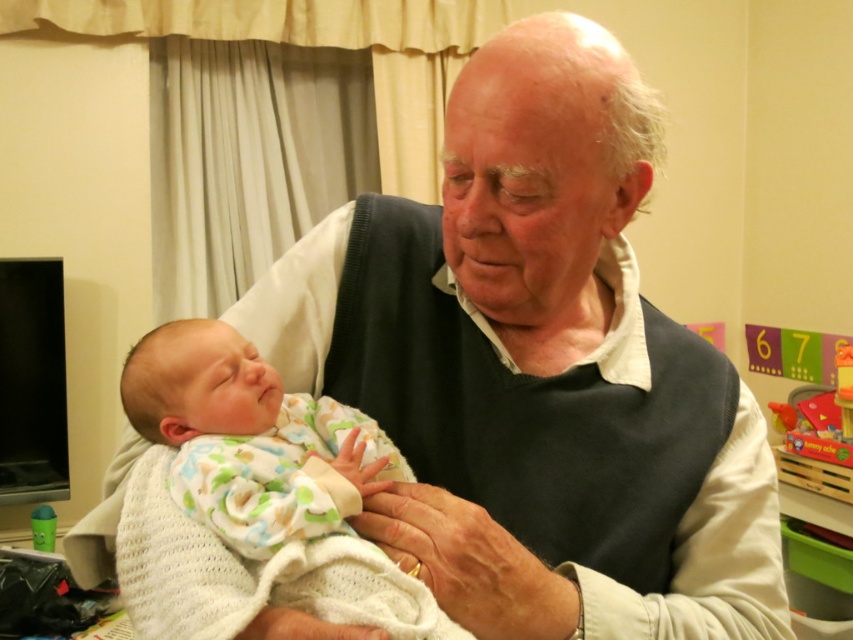
Question: Is white knit swaddle at center positioned behind dark gray sweater at center?

Choices:
 (A) no
 (B) yes

Answer: (A)

Question: Considering the relative positions of white knit swaddle at center and dark gray sweater at center in the image provided, where is white knit swaddle at center located with respect to dark gray sweater at center?

Choices:
 (A) below
 (B) above

Answer: (B)

Question: Which point appears closest to the camera in this image?

Choices:
 (A) (289, 472)
 (B) (428, 531)

Answer: (B)

Question: Does white knit swaddle at center have a smaller size compared to dark gray sweater at center?

Choices:
 (A) no
 (B) yes

Answer: (A)

Question: Among these points, which one is farthest from the camera?

Choices:
 (A) (491, 627)
 (B) (276, 534)

Answer: (B)